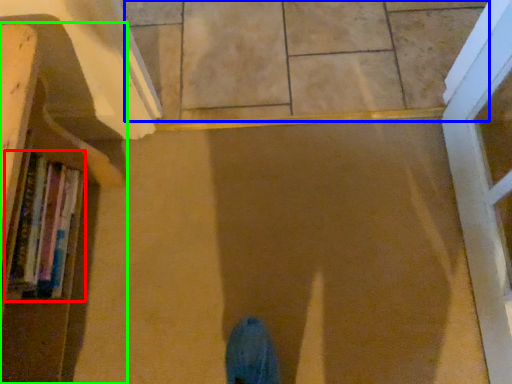
Question: Based on their relative distances, which object is nearer to book (highlighted by a red box)? Choose from tile (highlighted by a blue box) and bookcase (highlighted by a green box).

Choices:
 (A) tile
 (B) bookcase

Answer: (B)